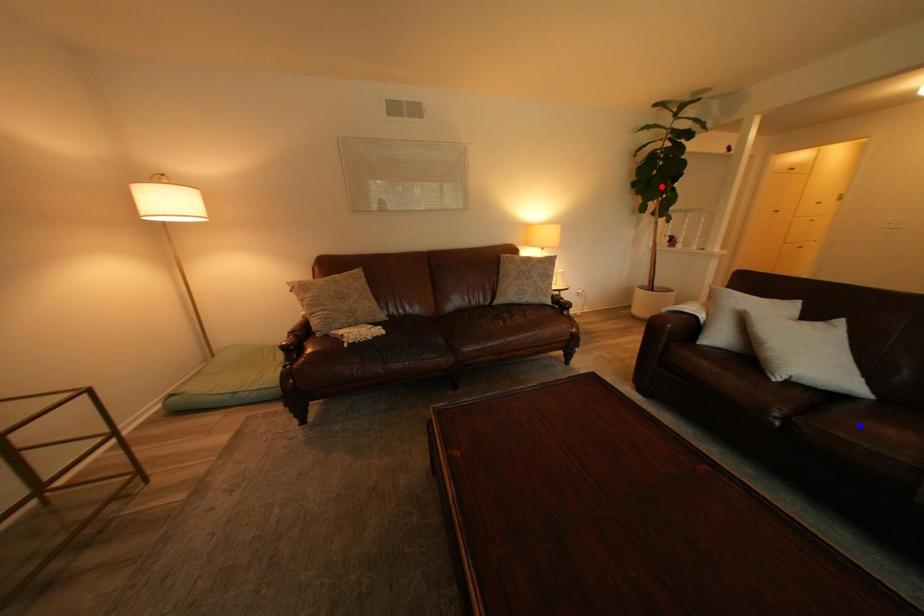
Question: Which of the two points in the image is closer to the camera?

Choices:
 (A) Blue point is closer.
 (B) Red point is closer.

Answer: (A)